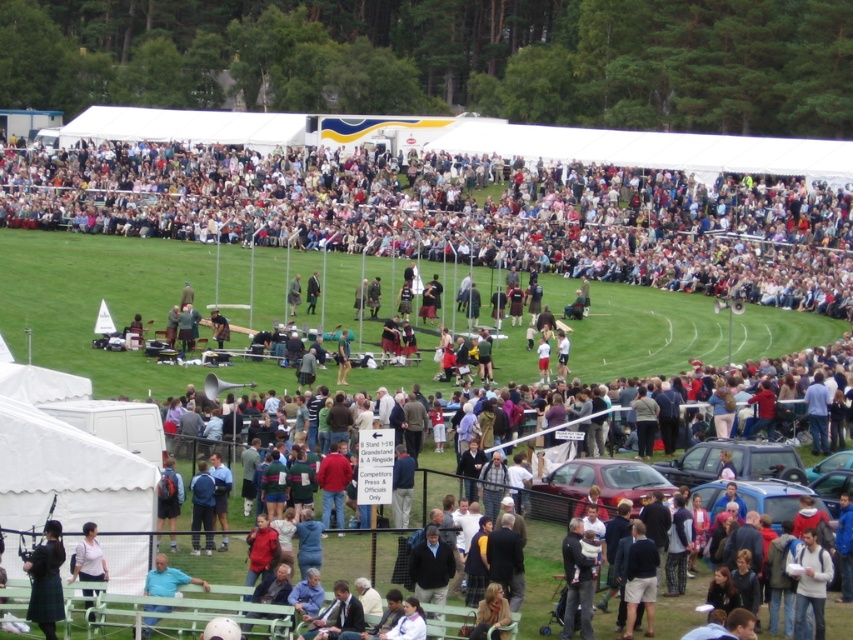
Question: Which object appears farthest from the camera in this image?

Choices:
 (A) light brown fabric crowd at upper center
 (B) matte red car at center
 (C) matte black car at center
 (D) dark brown kilt at lower left

Answer: (A)

Question: Does dark brown kilt at lower left have a smaller size compared to white matte shirt at lower left?

Choices:
 (A) yes
 (B) no

Answer: (B)

Question: Which of the following is the farthest from the observer?

Choices:
 (A) (222, 323)
 (B) (57, 544)
 (C) (724, 256)
 (D) (155, 577)

Answer: (C)

Question: Does white fabric tent at lower left have a smaller size compared to light blue shirt at lower left?

Choices:
 (A) yes
 (B) no

Answer: (B)

Question: Is dark brown kilt at lower left to the left of dark brown leather jacket at center from the viewer's perspective?

Choices:
 (A) yes
 (B) no

Answer: (B)

Question: Among these objects, which one is nearest to the camera?

Choices:
 (A) matte black car at center
 (B) dark brown leather jacket at center

Answer: (A)